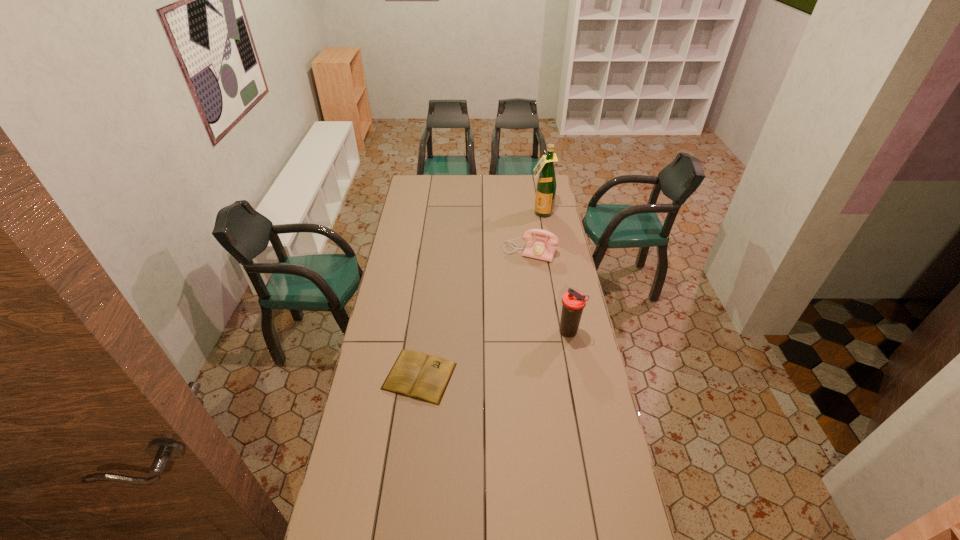
The image size is (960, 540). Identify the location of empty space that is in between the shortest object and the second farthest object. (475, 314).

Choose which object is the second nearest neighbor to the second farthest object. Please provide its 2D coordinates. Your answer should be formatted as a tuple, i.e. [(x, y)], where the tuple contains the x and y coordinates of a point satisfying the conditions above.

[(573, 302)]

Locate an element on the screen. This screenshot has height=540, width=960. object that stands as the third closest to the second shortest object is located at coordinates (414, 374).

Locate an element on the screen. free space that satisfies the following two spatial constraints: 1. on the front side of the third farthest object; 2. on the left side of the second farthest object is located at coordinates (541, 333).

Where is `vacant area that satisfies the following two spatial constraints: 1. on the front side of the farthest object; 2. on the right side of the second nearest object`? vacant area that satisfies the following two spatial constraints: 1. on the front side of the farthest object; 2. on the right side of the second nearest object is located at coordinates (564, 333).

Where is `blank area in the image that satisfies the following two spatial constraints: 1. on the back side of the second tallest object; 2. on the left side of the book`? The height and width of the screenshot is (540, 960). blank area in the image that satisfies the following two spatial constraints: 1. on the back side of the second tallest object; 2. on the left side of the book is located at coordinates (425, 333).

I want to click on free location that satisfies the following two spatial constraints: 1. on the back side of the third farthest object; 2. on the right side of the nearest object, so click(x=425, y=333).